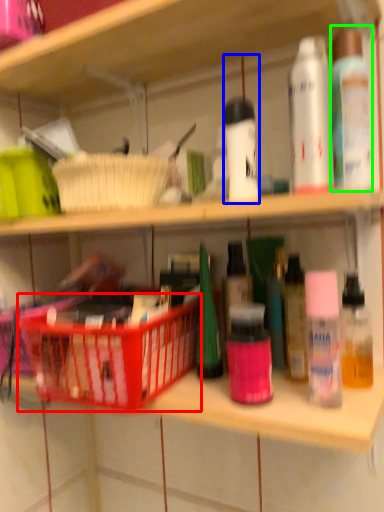
Question: Which object is positioned closest to basket (highlighted by a red box)? Select from toiletry (highlighted by a blue box) and toiletry (highlighted by a green box).

Choices:
 (A) toiletry
 (B) toiletry

Answer: (A)